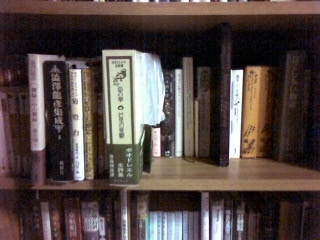
Locate an element on the screen. This screenshot has height=240, width=320. fourth book from top of bookcase on the left is located at coordinates (180, 63).